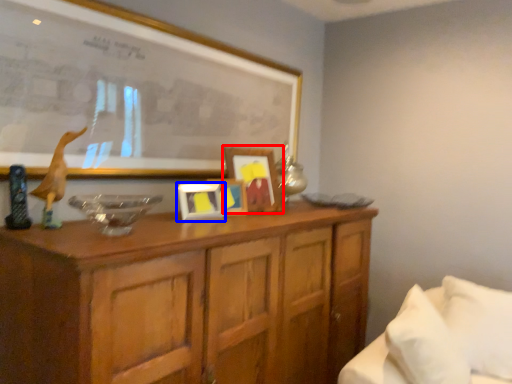
Question: Among these objects, which one is nearest to the camera, picture frame (highlighted by a red box) or picture frame (highlighted by a blue box)?

Choices:
 (A) picture frame
 (B) picture frame

Answer: (B)